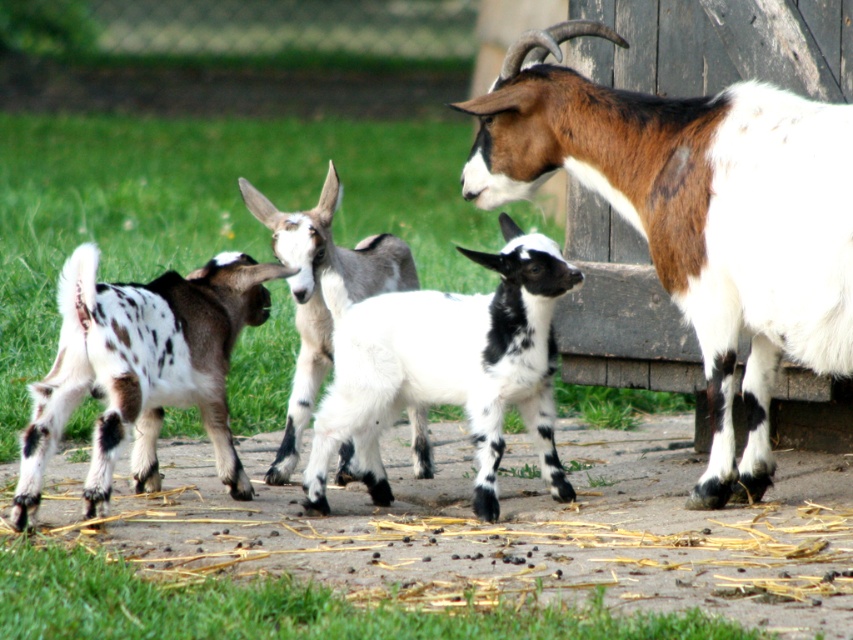
Can you confirm if white soft fur goat at center is wider than spotted fur goat at center?

Correct, the width of white soft fur goat at center exceeds that of spotted fur goat at center.

In the scene shown: Can you confirm if white soft fur goat at center is positioned to the right of spotted fur goat at center?

A: Indeed, white soft fur goat at center is positioned on the right side of spotted fur goat at center.

Identify the location of white soft fur goat at center. This screenshot has width=853, height=640. (445, 365).

Identify the location of white soft fur goat at center. (445, 365).

How distant is white soft fur goat at center from spotted fur kid goat at left?

They are 68.11 centimeters apart.

Where is `white soft fur goat at center`? This screenshot has width=853, height=640. white soft fur goat at center is located at coordinates [x=445, y=365].

Locate an element on the screen. This screenshot has height=640, width=853. white soft fur goat at center is located at coordinates (445, 365).

Does brown and white fur at right lie in front of spotted fur goat at center?

That is True.

Does point (724, 376) lie in front of point (328, 317)?

Yes, point (724, 376) is in front of point (328, 317).

The height and width of the screenshot is (640, 853). I want to click on brown and white fur at right, so click(697, 218).